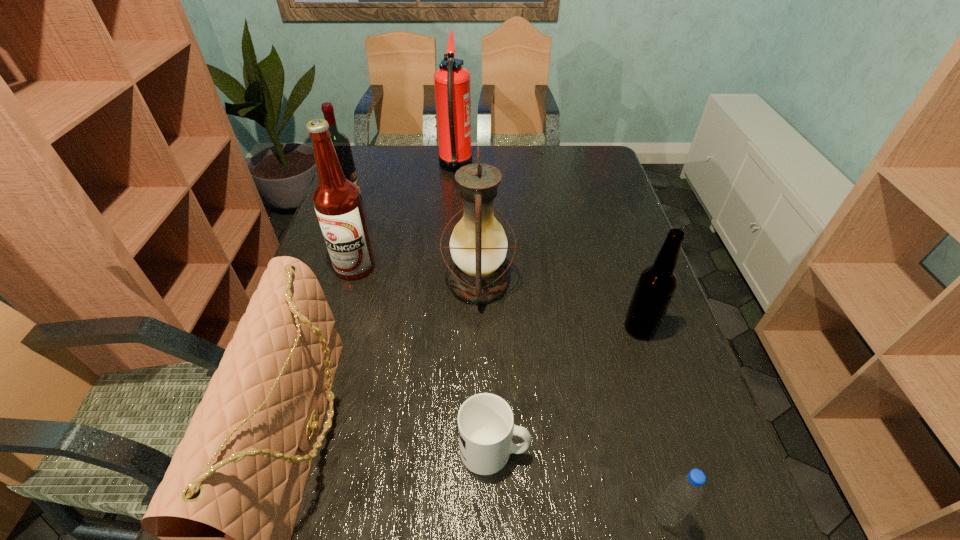
Find the location of `vacant space located on the right of the oil lamp`. vacant space located on the right of the oil lamp is located at coordinates (648, 284).

At what (x,y) coordinates should I click in order to perform the action: click on free space located on the front and back of the second farthest object. Please return your answer as a coordinate pair (x, y). This screenshot has height=540, width=960. Looking at the image, I should click on (445, 201).

Locate an element on the screen. free space located on the back of the beer bottle is located at coordinates (625, 284).

This screenshot has height=540, width=960. I want to click on vacant area located 0.340m on the back of the seventh tallest object, so click(x=619, y=346).

The height and width of the screenshot is (540, 960). Find the location of `vacant space located 0.260m on the handle side of the mug`. vacant space located 0.260m on the handle side of the mug is located at coordinates (662, 449).

This screenshot has height=540, width=960. I want to click on object at the far edge, so click(x=452, y=81).

Find the location of `object that is positioned at the near edge`. object that is positioned at the near edge is located at coordinates (685, 491).

At what (x,y) coordinates should I click in order to perform the action: click on beer bottle that is positioned at the right edge. Please return your answer as a coordinate pair (x, y). Looking at the image, I should click on (655, 288).

Find the location of a particular element. water bottle at the right edge is located at coordinates (685, 491).

Where is `object positioned at the near right corner`? object positioned at the near right corner is located at coordinates (685, 491).